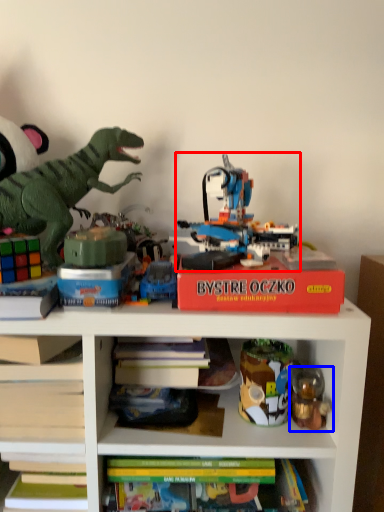
Question: Which object is further to the camera taking this photo, toy (highlighted by a red box) or toy (highlighted by a blue box)?

Choices:
 (A) toy
 (B) toy

Answer: (A)